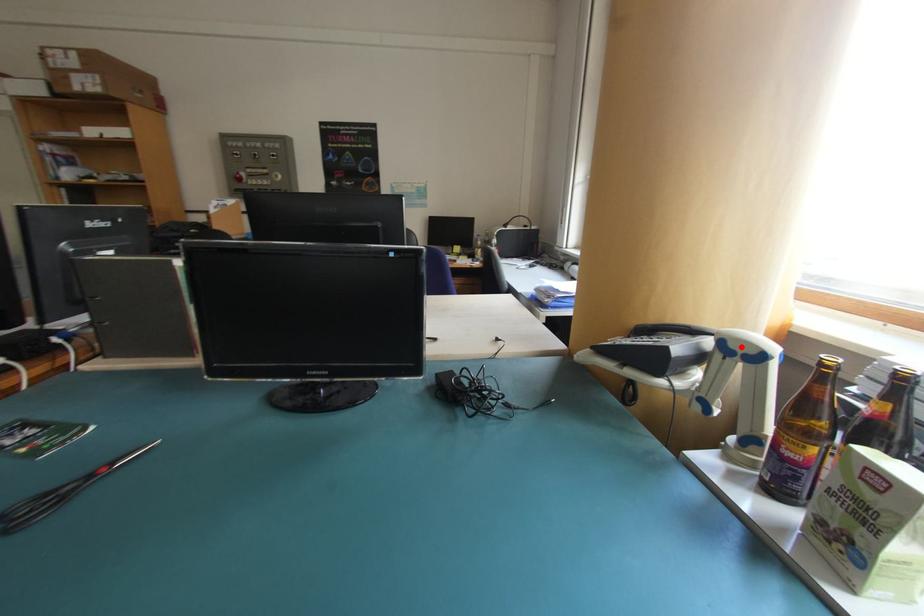
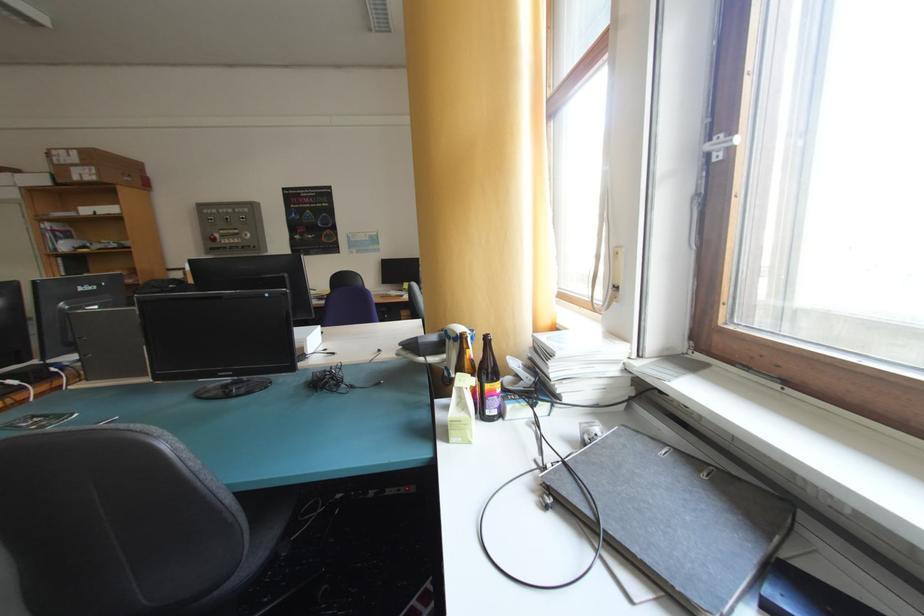
Find the pixel in the second image that matches the highlighted location in the first image.

(457, 334)